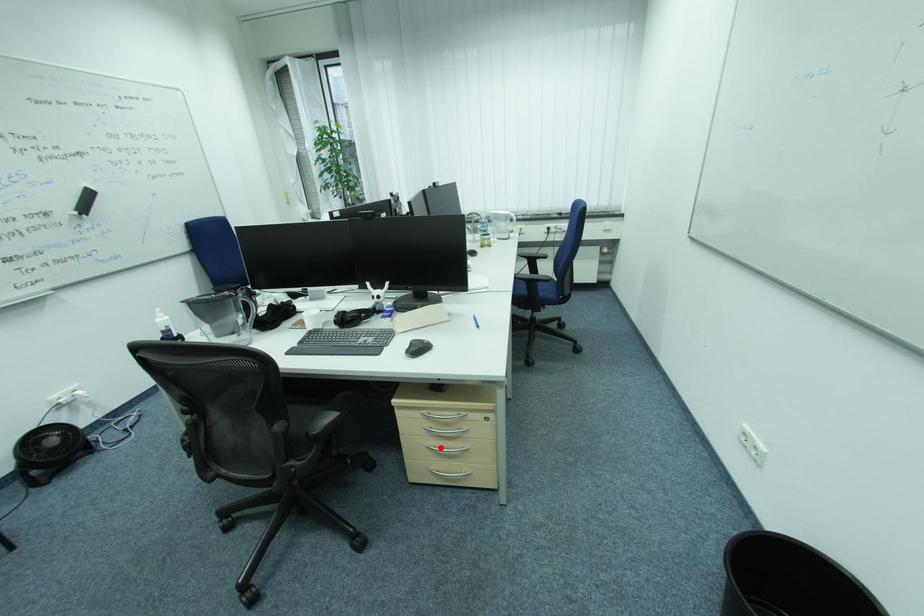
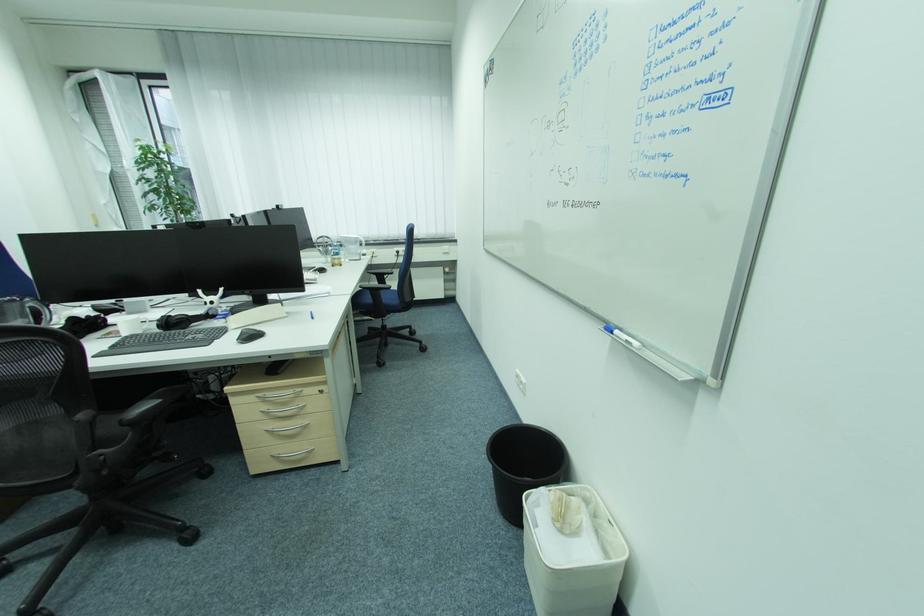
Locate, in the second image, the point that corresponds to the highlighted location in the first image.

(281, 430)